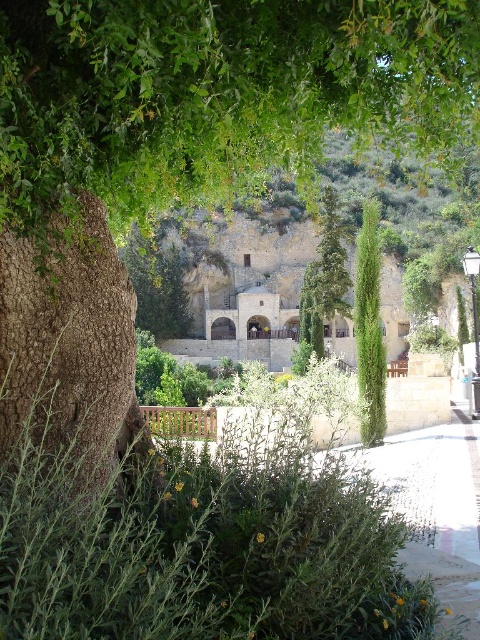
From the picture: Is brown wooden bench at lower center behind green textured cypress at center?

No, brown wooden bench at lower center is in front of green textured cypress at center.

Which is in front, point (404, 477) or point (383, 356)?

Point (404, 477) is in front.

Find the location of a particular element. This screenshot has height=640, width=480. brown wooden bench at lower center is located at coordinates (434, 504).